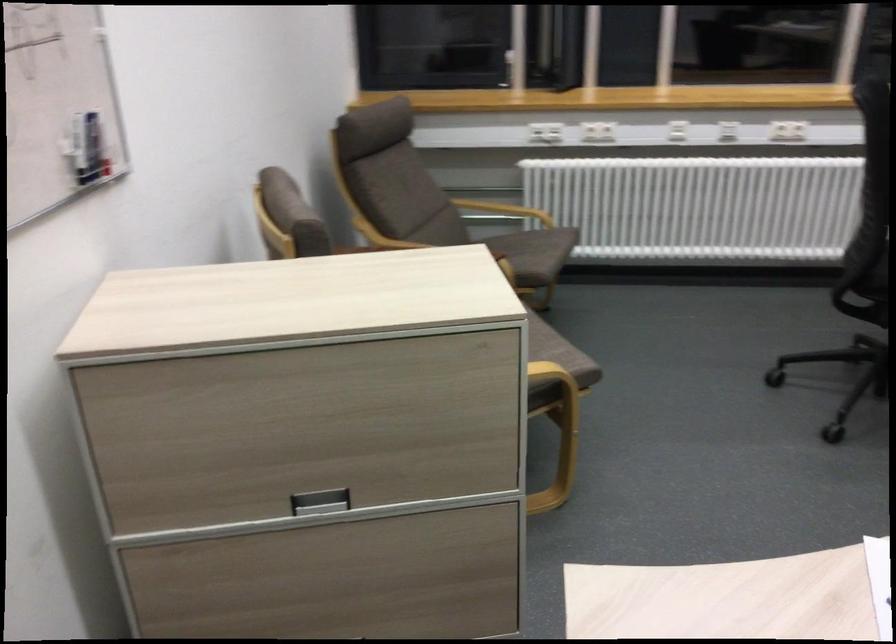
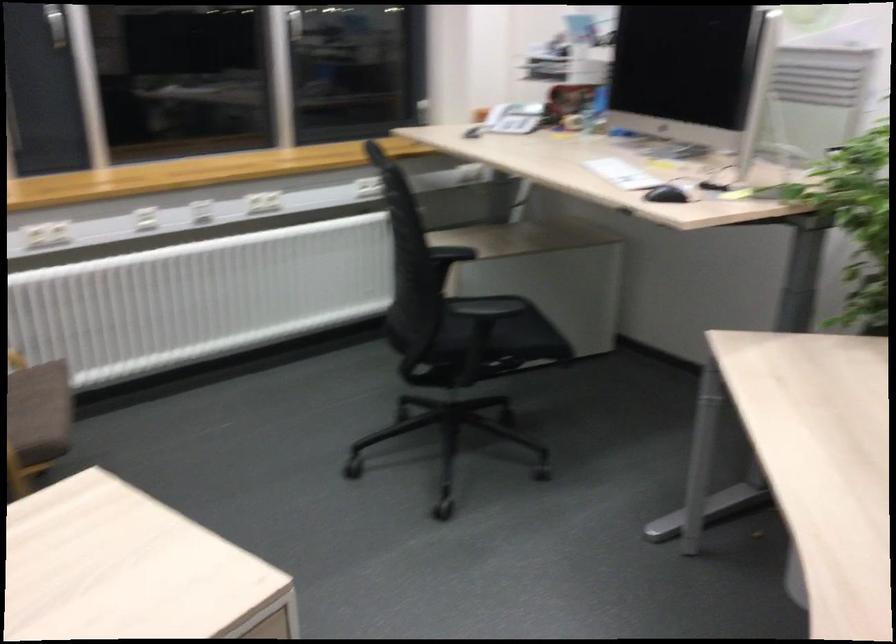
Question: The camera is either moving clockwise (left) or counter-clockwise (right) around the object. The first image is from the beginning of the video and the second image is from the end. Is the camera moving left or right when shooting the video?

Choices:
 (A) Left
 (B) Right

Answer: (A)